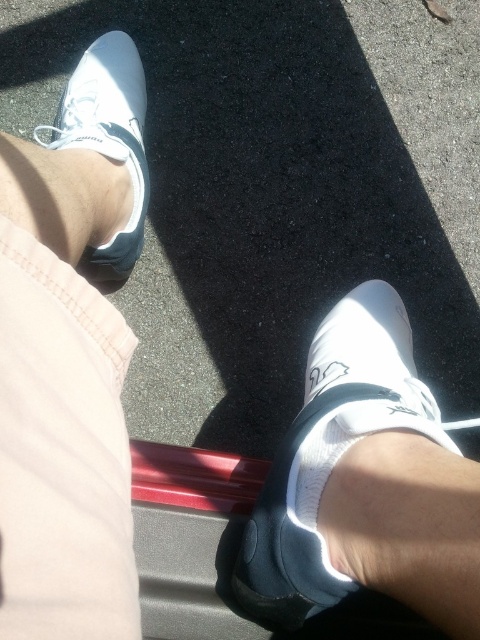
Which is below, white matte shoe at lower center or white matte shoe at upper left?

white matte shoe at lower center is lower down.

In the scene shown: Which of these two, white matte shoe at lower center or white matte shoe at upper left, stands taller?

white matte shoe at upper left is taller.

What do you see at coordinates (330, 451) in the screenshot? I see `white matte shoe at lower center` at bounding box center [330, 451].

Where is `white matte shoe at lower center`? The image size is (480, 640). white matte shoe at lower center is located at coordinates click(330, 451).